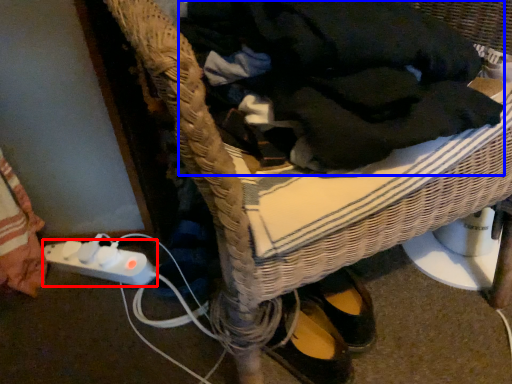
Question: Among these objects, which one is nearest to the camera, plug (highlighted by a red box) or clothing (highlighted by a blue box)?

Choices:
 (A) plug
 (B) clothing

Answer: (B)